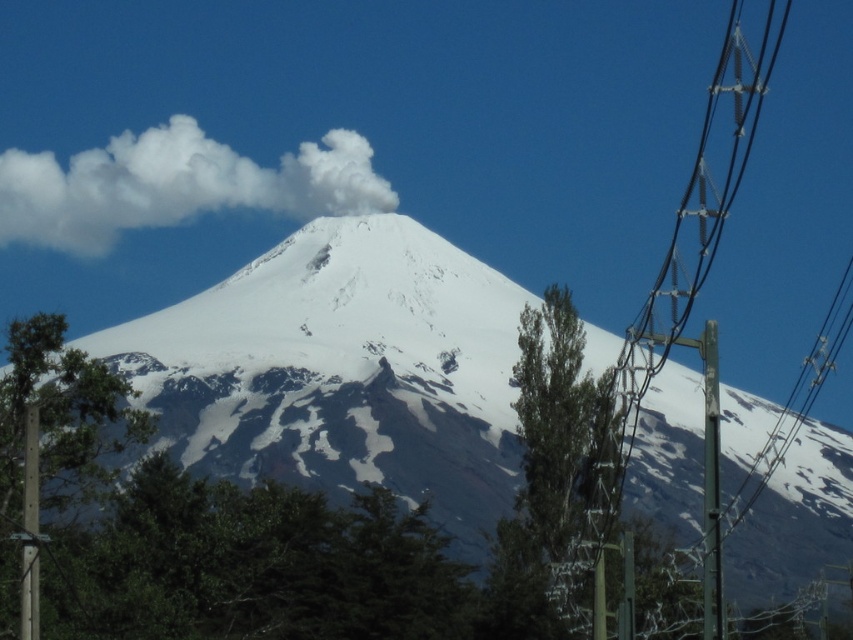
From the picture: You are a bird trying to land on the metallic silver power line at right and the green metallic pole at right. Which one has a wider surface for landing?

The metallic silver power line at right has a larger width than the green metallic pole at right, so it has a wider surface for landing.